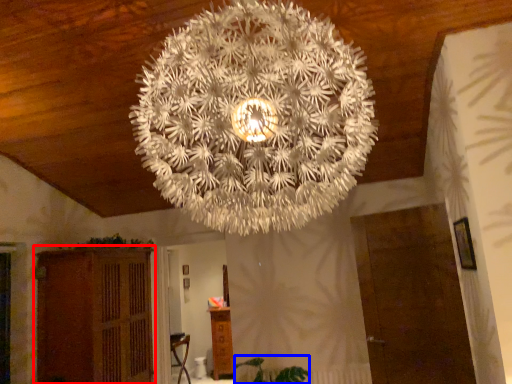
Question: Which object appears farthest to the camera in this image, furniture (highlighted by a red box) or plant (highlighted by a blue box)?

Choices:
 (A) furniture
 (B) plant

Answer: (B)